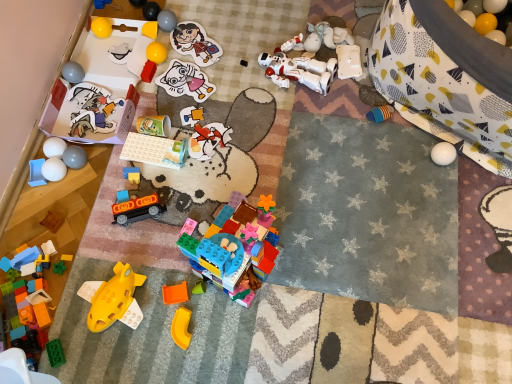
Find the location of a particular element. The width and height of the screenshot is (512, 384). free area in between white plastic remote control at upper center, which is the second toy from right to left, and translucent orange plastic toy at center, the fourth toy in the right-to-left sequence is located at coordinates (297, 142).